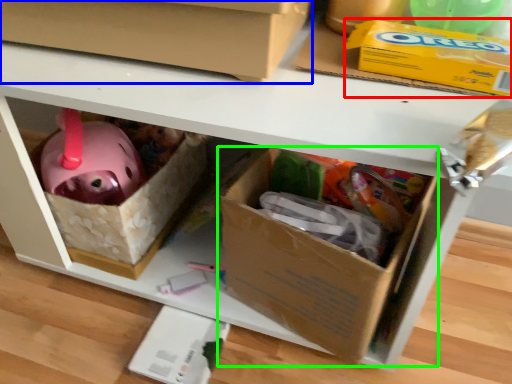
Question: Considering the real-world distances, which object is farthest from storage box (highlighted by a red box)? box (highlighted by a blue box) or box (highlighted by a green box)?

Choices:
 (A) box
 (B) box

Answer: (B)